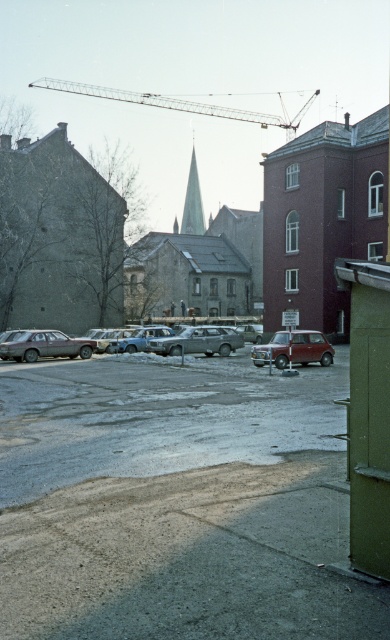
Is metallic gray crane at upper center smaller than silver metallic car at center?

Actually, metallic gray crane at upper center might be larger than silver metallic car at center.

Between metallic gray crane at upper center and silver metallic car at center, which one is positioned lower?

silver metallic car at center is lower down.

Who is more distant from viewer, (111, 92) or (177, 353)?

Positioned behind is point (111, 92).

Locate an element on the screen. The height and width of the screenshot is (640, 390). metallic gray crane at upper center is located at coordinates (180, 104).

Is metallic red car at center thinner than matte gray car at lower left?

No, metallic red car at center is not thinner than matte gray car at lower left.

What are the coordinates of `metallic red car at center` in the screenshot? It's located at (294, 348).

Describe the element at coordinates (294, 348) in the screenshot. The height and width of the screenshot is (640, 390). I see `metallic red car at center` at that location.

The width and height of the screenshot is (390, 640). Identify the location of metallic red car at center. (294, 348).

Does point (283, 124) lie behind point (134, 336)?

Yes, it is.

Can you confirm if metallic gray crane at upper center is taller than light blue metallic car at center?

Yes.

Locate an element on the screen. The height and width of the screenshot is (640, 390). metallic gray crane at upper center is located at coordinates (180, 104).